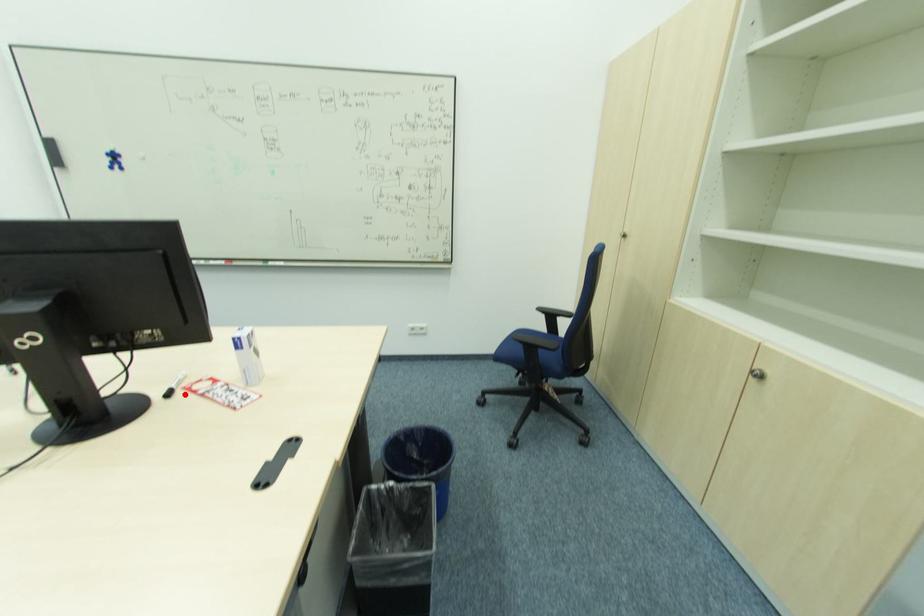
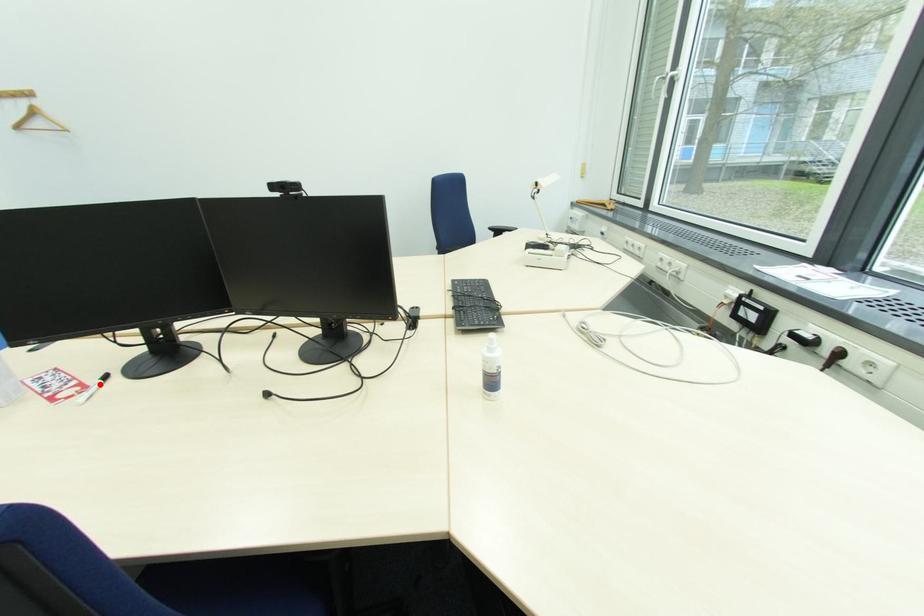
I am providing you with two images of the same scene from different viewpoints. A red point is marked on the first image and another point is marked on the second image. Are the points marked in image1 and image2 representing the same 3D position?

Yes